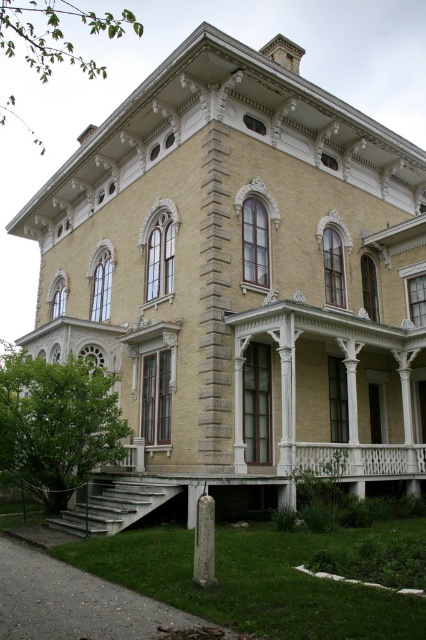
Question: Which of the following is the closest to the observer?

Choices:
 (A) white stone post at lower center
 (B) white painted wood porch at lower center
 (C) white wood balustrade at center

Answer: (A)

Question: Observing the image, what is the correct spatial positioning of white painted wood porch at lower center in reference to white stone post at lower center?

Choices:
 (A) below
 (B) above

Answer: (A)

Question: From the image, what is the correct spatial relationship of white wood balustrade at center in relation to white stone post at lower center?

Choices:
 (A) right
 (B) left

Answer: (A)

Question: Does white painted wood porch at lower center have a larger size compared to white wood balustrade at center?

Choices:
 (A) no
 (B) yes

Answer: (B)

Question: Which point appears farthest from the camera in this image?

Choices:
 (A) (163, 490)
 (B) (380, 461)
 (C) (212, 566)

Answer: (B)

Question: Which point is farther to the camera?

Choices:
 (A) white painted wood porch at lower center
 (B) white stone post at lower center

Answer: (A)